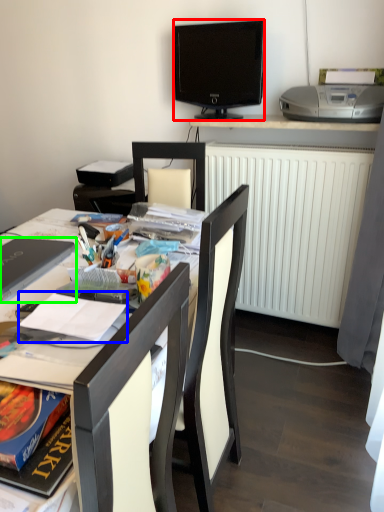
Question: Based on their relative distances, which object is farther from television (highlighted by a red box)? Choose from magazine (highlighted by a blue box) and laptop (highlighted by a green box).

Choices:
 (A) magazine
 (B) laptop

Answer: (A)